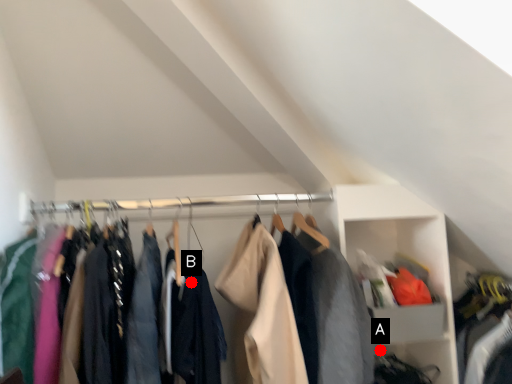
Question: Two points are circled on the image, labeled by A and B beside each circle. Which of the following is the closest to the observer?

Choices:
 (A) A is closer
 (B) B is closer

Answer: (B)